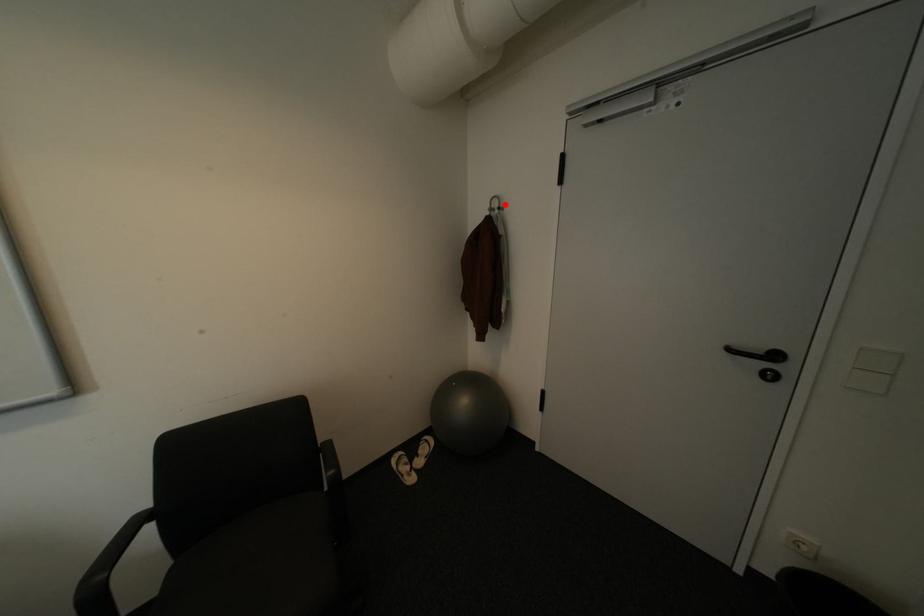
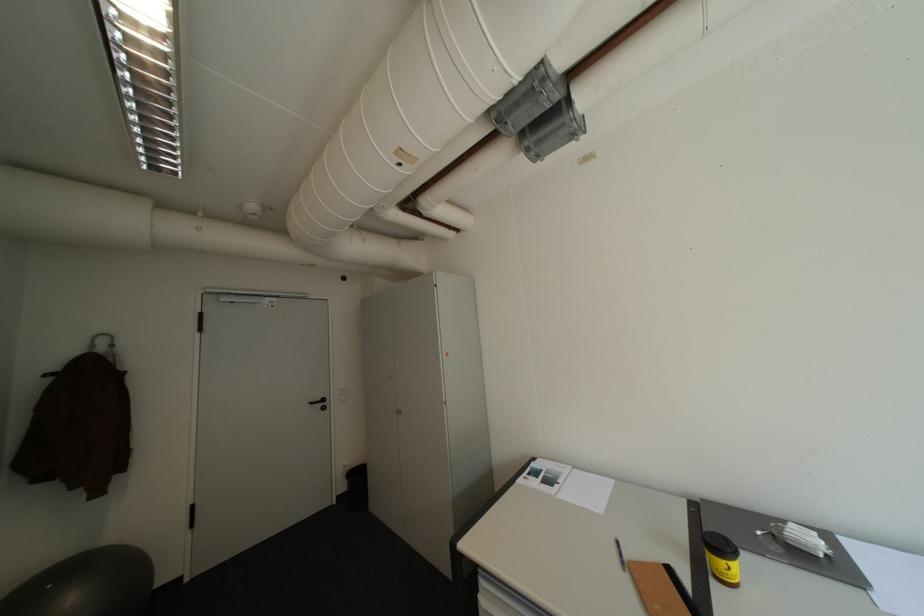
The point at the highlighted location is marked in the first image. Where is the corresponding point in the second image?

(113, 342)